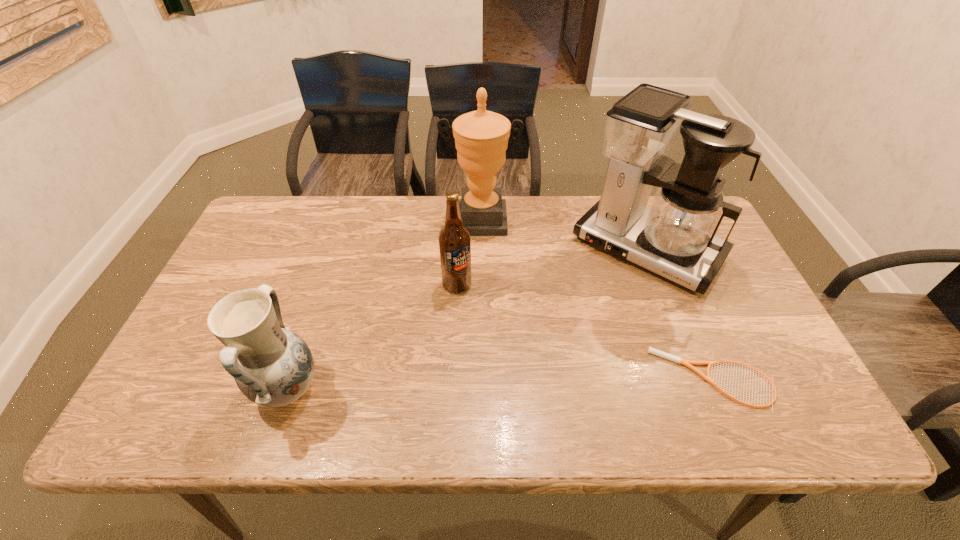
The height and width of the screenshot is (540, 960). What are the coordinates of `vacant space in between the coffee maker and the beer bottle` in the screenshot? It's located at (552, 267).

The image size is (960, 540). Identify the location of free space between the shortest object and the coffee maker. (681, 314).

Locate an element on the screen. The width and height of the screenshot is (960, 540). free spot between the tennis racket and the coffee maker is located at coordinates (681, 314).

Find the location of a particular element. The image size is (960, 540). vacant space that is in between the pottery and the beer bottle is located at coordinates (372, 337).

Locate an element on the screen. empty location between the coffee maker and the award is located at coordinates (564, 234).

You are a GUI agent. You are given a task and a screenshot of the screen. Output one action in this format:
    pyautogui.click(x=<x>, y=<y>)
    Task: Click on the free spot between the tennis racket and the award
    The image size is (960, 540).
    Given the screenshot: What is the action you would take?
    pos(597,300)

Locate an element on the screen. The image size is (960, 540). free spot between the beer bottle and the tennis racket is located at coordinates (586, 332).

Locate an element on the screen. This screenshot has width=960, height=540. free space between the award and the shortest object is located at coordinates (597, 300).

Find the location of `free spot between the beer bottle and the pottery`. free spot between the beer bottle and the pottery is located at coordinates (372, 337).

Where is `vacant point located between the beer bottle and the shortest object`? This screenshot has height=540, width=960. vacant point located between the beer bottle and the shortest object is located at coordinates (586, 332).